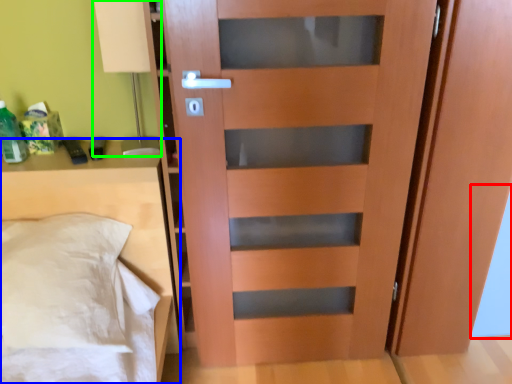
Question: Which is farther away from glass door (highlighted by a red box)? furniture (highlighted by a blue box) or table lamp (highlighted by a green box)?

Choices:
 (A) furniture
 (B) table lamp

Answer: (B)